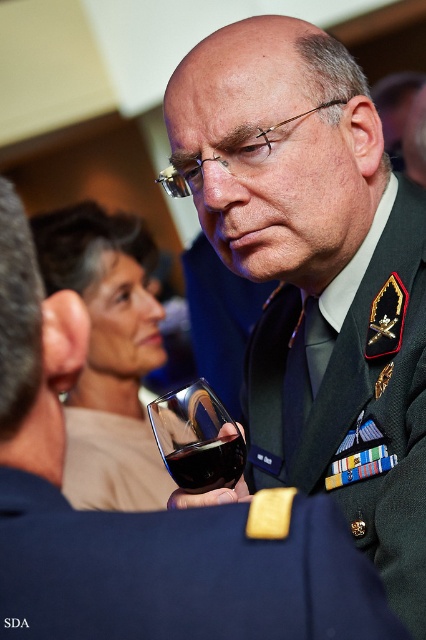
Does point (304, 371) lie behind point (241, 436)?

Yes, point (304, 371) is behind point (241, 436).

Is point (282, 65) in front of point (181, 477)?

No, it is not.

Between point (215, 77) and point (219, 477), which one is positioned in front?

Point (219, 477) is more forward.

At what (x,y) coordinates should I click in order to perform the action: click on green military uniform at center. Please return your answer as a coordinate pair (x, y). The image size is (426, 640). Looking at the image, I should click on (316, 276).

Which is in front, point (313, 580) or point (207, 486)?

Point (313, 580) is in front.

Does navy blue fabric at center have a smaller size compared to dark red liquid at center?

No.

Is point (11, 627) behind point (181, 460)?

No, it is in front of (181, 460).

Find the location of `navy blue fabric at center`. navy blue fabric at center is located at coordinates (180, 572).

Which is in front, point (210, 544) or point (207, 435)?

Point (210, 544)

Is navy blue fabric at center bigger than transparent glass at center?

Yes, navy blue fabric at center is bigger than transparent glass at center.

I want to click on navy blue fabric at center, so click(180, 572).

The image size is (426, 640). What are the coordinates of `navy blue fabric at center` in the screenshot? It's located at (180, 572).